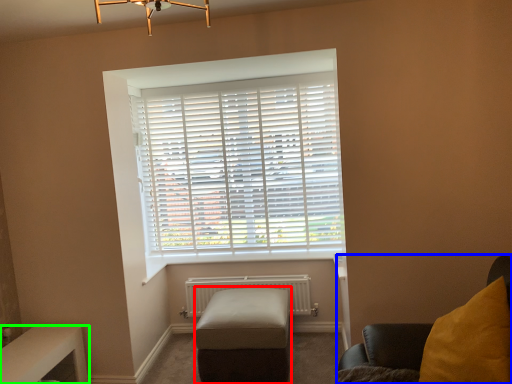
Question: Based on their relative distances, which object is nearer to stool (highlighted by a red box)? Choose from furniture (highlighted by a blue box) and table (highlighted by a green box).

Choices:
 (A) furniture
 (B) table

Answer: (A)